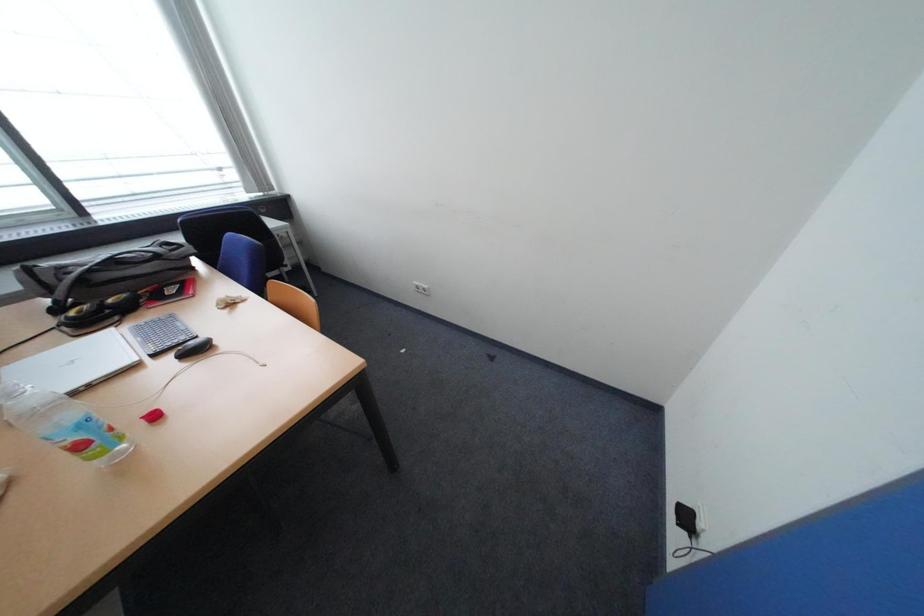
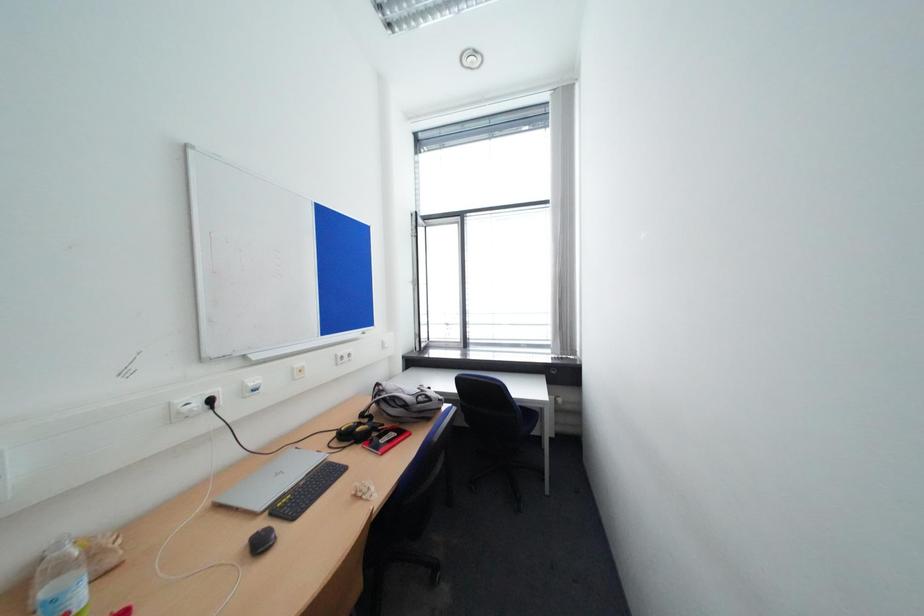
Question: Based on the continuous images, in which direction is the camera rotating? Reply with the corresponding letter.

Choices:
 (A) Left
 (B) Right
 (C) Up
 (D) Down

Answer: (A)